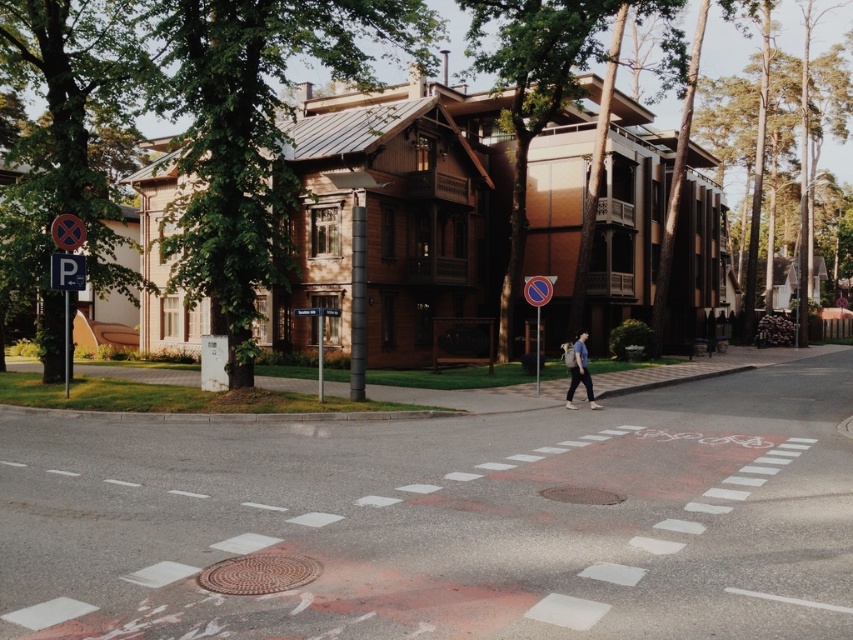
You are a photographer wanting to capture both the green leafy tree at left and the blue cotton shirt at center in the same frame. Which object should you focus on first to ensure both are in the frame?

The green leafy tree at left is bigger than the blue cotton shirt at center, so you should focus on the green leafy tree at left first to ensure both are in the frame.

You are a delivery person carrying a package and need to place it exactly 25 meters away from the blue cotton shirt at center. Can you place it near the green leafy tree at left?

The green leafy tree at left is 25.78 meters from the blue cotton shirt at center, so yes, placing the package near the green leafy tree at left would be within the required distance of 25 meters.